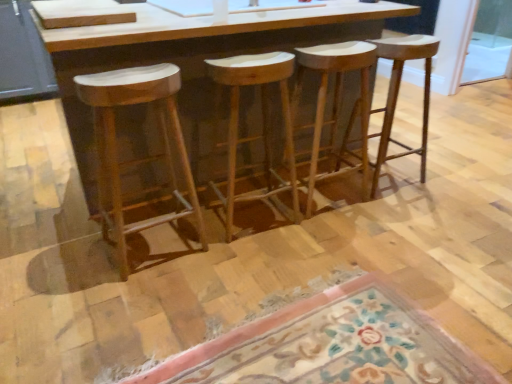
Find the location of a particular element. free space in front of wooden barstools at center is located at coordinates (220, 276).